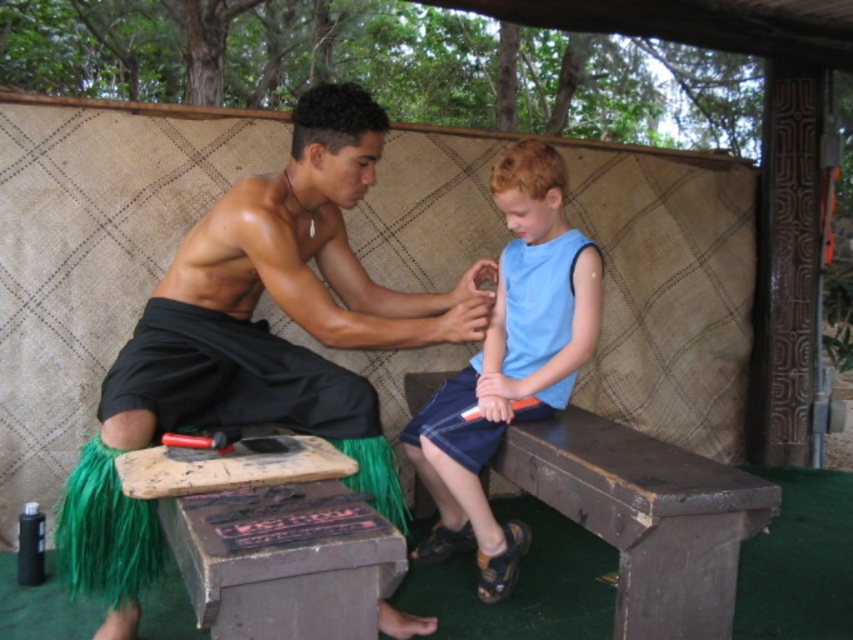
Locate an element on the screen. The height and width of the screenshot is (640, 853). black matte grass skirt at center is located at coordinates (258, 342).

Does black matte grass skirt at center come behind blue cotton shirt at center?

No, it is not.

Does point (318, 163) come closer to viewer compared to point (482, 493)?

That is True.

Image resolution: width=853 pixels, height=640 pixels. In order to click on black matte grass skirt at center in this screenshot , I will do [x=258, y=342].

Does blue cotton shirt at center have a lesser height compared to brown wooden bench at lower center?

Incorrect, blue cotton shirt at center's height does not fall short of brown wooden bench at lower center's.

Image resolution: width=853 pixels, height=640 pixels. I want to click on blue cotton shirt at center, so click(509, 364).

Measure the distance between point (x=521, y=300) and camera.

Point (x=521, y=300) is 8.56 feet from camera.

Image resolution: width=853 pixels, height=640 pixels. I want to click on blue cotton shirt at center, so pos(509,364).

Is point (189, 314) behind point (625, 433)?

No, (189, 314) is closer to viewer.

Does black matte grass skirt at center appear under brown wooden bench at lower center?

No, black matte grass skirt at center is not below brown wooden bench at lower center.

Identify the location of black matte grass skirt at center. (258, 342).

Find the location of a particular element. This screenshot has width=853, height=640. black matte grass skirt at center is located at coordinates (258, 342).